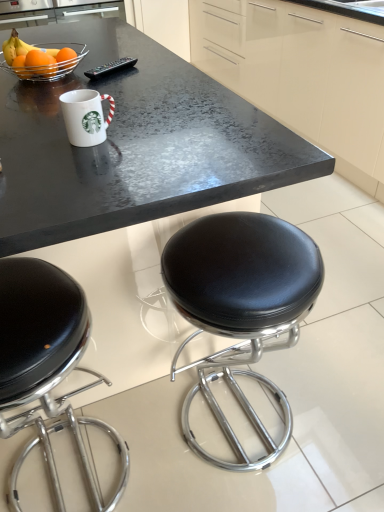
What are the coordinates of `orangesmoothfruit at upper left, which is counted as the 2th orange, starting from the front` in the screenshot? It's located at (66, 58).

What is the approximate width of glossy cream cabinetry at upper center?

glossy cream cabinetry at upper center is 60.21 centimeters in width.

What do you see at coordinates (86, 116) in the screenshot? I see `white glossy mug at upper center` at bounding box center [86, 116].

Where is `black leather stool at center`? The height and width of the screenshot is (512, 384). black leather stool at center is located at coordinates (241, 307).

Image resolution: width=384 pixels, height=512 pixels. I want to click on black plastic remote control at upper center, so click(x=110, y=68).

Who is smaller, orangesmoothfruit at upper left, which is the first orange in back-to-front order, or black plastic remote control at upper center?

With smaller size is orangesmoothfruit at upper left, which is the first orange in back-to-front order.

From a real-world perspective, starting from the black plastic remote control at upper center, which orange is the 1st one vertically above it? Please provide its 2D coordinates.

[(66, 58)]

Is black plastic remote control at upper center completely or partially inside orangesmoothfruit at upper left, which is the first orange in back-to-front order?

Actually, black plastic remote control at upper center is outside orangesmoothfruit at upper left, which is the first orange in back-to-front order.

Is black leather stool at lower left beside matte orange at upper left, which ranks as the 1th orange in front-to-back order?

No, black leather stool at lower left is not making contact with matte orange at upper left, which ranks as the 1th orange in front-to-back order.

Image resolution: width=384 pixels, height=512 pixels. I want to click on chair that is on the right side of matte orange at upper left, which ranks as the 1th orange in front-to-back order, so click(46, 362).

How much distance is there between black leather stool at lower left and matte orange at upper left, which ranks as the 1th orange in front-to-back order?

They are 37.32 inches apart.

Does black leather stool at lower left have a lesser width compared to matte orange at upper left, which ranks as the 1th orange in front-to-back order?

Incorrect, the width of black leather stool at lower left is not less than that of matte orange at upper left, which ranks as the 1th orange in front-to-back order.

Would you consider white glossy mug at upper center to be distant from black plastic remote control at upper center?

No, white glossy mug at upper center is not far from black plastic remote control at upper center.

Considering the sizes of objects white glossy mug at upper center and black plastic remote control at upper center in the image provided, who is taller, white glossy mug at upper center or black plastic remote control at upper center?

white glossy mug at upper center.

From a real-world perspective, between white glossy mug at upper center and black plastic remote control at upper center, who is vertically higher?

white glossy mug at upper center, from a real-world perspective.

Can you tell me how much white glossy mug at upper center and black plastic remote control at upper center differ in facing direction?

The facing directions of white glossy mug at upper center and black plastic remote control at upper center are 123 degrees apart.

Is black plastic remote control at upper center bigger or smaller than metallic wire basket at upper left?

Clearly, black plastic remote control at upper center is smaller in size than metallic wire basket at upper left.

From the image's perspective, between black plastic remote control at upper center and metallic wire basket at upper left, who is located below?

metallic wire basket at upper left appears lower in the image.

Can you tell me how much black plastic remote control at upper center and metallic wire basket at upper left differ in facing direction?

122 degrees.

Is the position of black plastic remote control at upper center more distant than that of metallic wire basket at upper left?

Yes, black plastic remote control at upper center is behind metallic wire basket at upper left.

Can you confirm if orangesmoothfruit at upper left, which is counted as the 2th orange, starting from the front, is smaller than white glossy mug at upper center?

Indeed, orangesmoothfruit at upper left, which is counted as the 2th orange, starting from the front, has a smaller size compared to white glossy mug at upper center.

Could white glossy mug at upper center be considered to be inside orangesmoothfruit at upper left, which is counted as the 2th orange, starting from the front?

No, white glossy mug at upper center is located outside of orangesmoothfruit at upper left, which is counted as the 2th orange, starting from the front.

Between point (70, 51) and point (89, 146), which one is positioned behind?

The point (70, 51) is behind.

Where is `the 2nd orange behind the white glossy mug at upper center`? Image resolution: width=384 pixels, height=512 pixels. the 2nd orange behind the white glossy mug at upper center is located at coordinates (66, 58).

Is black leather stool at lower left not close to black plastic remote control at upper center?

black leather stool at lower left is near black plastic remote control at upper center, not far away.

Is black leather stool at lower left facing towards black plastic remote control at upper center?

No, black leather stool at lower left is not turned towards black plastic remote control at upper center.

From a real-world perspective, which object stands above the other?

From a 3D spatial view, black plastic remote control at upper center is above.

Is black leather stool at lower left closer to the viewer compared to black plastic remote control at upper center?

Yes.

In terms of width, does glossy cream cabinetry at upper center look wider or thinner when compared to matte orange at upper left, which ranks as the 1th orange in front-to-back order?

glossy cream cabinetry at upper center is wider than matte orange at upper left, which ranks as the 1th orange in front-to-back order.

Can you confirm if glossy cream cabinetry at upper center is taller than matte orange at upper left, which ranks as the 1th orange in front-to-back order?

Yes, glossy cream cabinetry at upper center is taller than matte orange at upper left, which ranks as the 1th orange in front-to-back order.

How many degrees apart are the facing directions of glossy cream cabinetry at upper center and matte orange at upper left, the second orange when ordered from back to front?

The angle between the facing direction of glossy cream cabinetry at upper center and the facing direction of matte orange at upper left, the second orange when ordered from back to front, is 180 degrees.

Where is `orange that is the 1st object to the left of the black plastic remote control at upper center, starting at the anchor`? This screenshot has width=384, height=512. orange that is the 1st object to the left of the black plastic remote control at upper center, starting at the anchor is located at coordinates (66, 58).

At what (x,y) coordinates should I click in order to perform the action: click on chair below the matte orange at upper left, the second orange when ordered from back to front (from the image's perspective). Please return your answer as a coordinate pair (x, y). This screenshot has width=384, height=512. Looking at the image, I should click on (46, 362).

Considering their positions, is black plastic remote control at upper center positioned closer to black leather stool at lower left than matte orange at upper left, the second orange when ordered from back to front?

Based on the image, matte orange at upper left, the second orange when ordered from back to front, appears to be nearer to black leather stool at lower left.

Considering their positions, is white glossy mug at upper center positioned further to orangesmoothfruit at upper left, which is counted as the 2th orange, starting from the front, than black leather stool at center?

Based on the image, black leather stool at center appears to be further to orangesmoothfruit at upper left, which is counted as the 2th orange, starting from the front.

Based on their spatial positions, is black leather stool at lower left or metallic wire basket at upper left closer to matte orange at upper left, which ranks as the 1th orange in front-to-back order?

Among the two, metallic wire basket at upper left is located nearer to matte orange at upper left, which ranks as the 1th orange in front-to-back order.

Estimate the real-world distances between objects in this image. Which object is closer to black plastic remote control at upper center, black leather stool at lower left or metallic wire basket at upper left?

metallic wire basket at upper left is closer to black plastic remote control at upper center.

Considering their positions, is black leather stool at lower left positioned further to black plastic remote control at upper center than white glossy mug at upper center?

black leather stool at lower left is further to black plastic remote control at upper center.

Looking at the image, which one is located further to white glossy mug at upper center, black plastic remote control at upper center or black leather stool at lower left?

The object further to white glossy mug at upper center is black leather stool at lower left.

From the image, which object appears to be farther from glossy cream cabinetry at upper center, black leather stool at lower left or black plastic remote control at upper center?

black leather stool at lower left lies further to glossy cream cabinetry at upper center than the other object.

Based on their spatial positions, is glossy cream cabinetry at upper center or metallic wire basket at upper left further from matte orange at upper left, the second orange when ordered from back to front?

Based on the image, glossy cream cabinetry at upper center appears to be further to matte orange at upper left, the second orange when ordered from back to front.

In order to click on appliance that lies between glossy cream cabinetry at upper center and white glossy mug at upper center from top to bottom in this screenshot , I will do `click(110, 68)`.

Locate an element on the screen. The image size is (384, 512). appliance that lies between glossy cream cabinetry at upper center and black leather stool at center from top to bottom is located at coordinates (110, 68).

The width and height of the screenshot is (384, 512). I want to click on appliance between orangesmoothfruit at upper left, which is counted as the 2th orange, starting from the front, and black leather stool at center from top to bottom, so click(110, 68).

You are a GUI agent. You are given a task and a screenshot of the screen. Output one action in this format:
    pyautogui.click(x=<x>, y=<y>)
    Task: Click on the bowl between white glossy mug at upper center and orangesmoothfruit at upper left, which is counted as the 2th orange, starting from the front, from front to back
    The height and width of the screenshot is (512, 384).
    Given the screenshot: What is the action you would take?
    pyautogui.click(x=41, y=64)